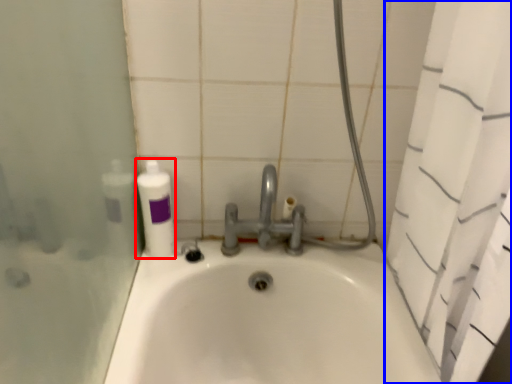
Question: Which point is closer to the camera, cleaning product (highlighted by a red box) or shower curtain (highlighted by a blue box)?

Choices:
 (A) cleaning product
 (B) shower curtain

Answer: (B)